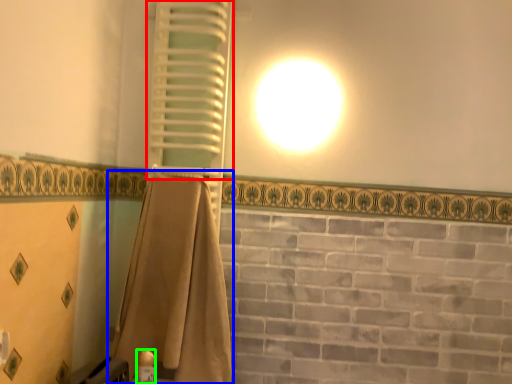
Question: Based on their relative distances, which object is nearer to shutter (highlighted by a red box)? Choose from curtain (highlighted by a blue box) and toiletry (highlighted by a green box).

Choices:
 (A) curtain
 (B) toiletry

Answer: (A)